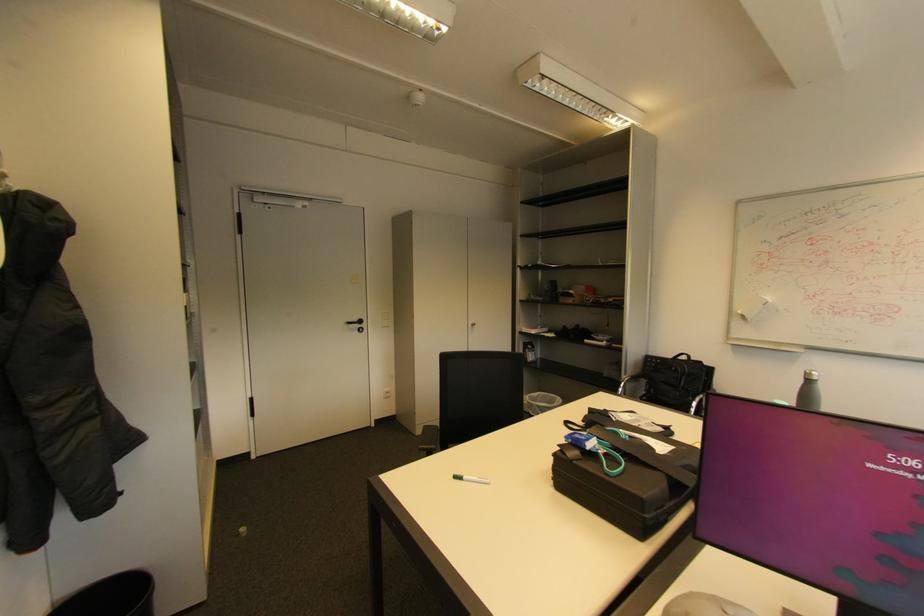
Where is `black door handle`? black door handle is located at coordinates (358, 323).